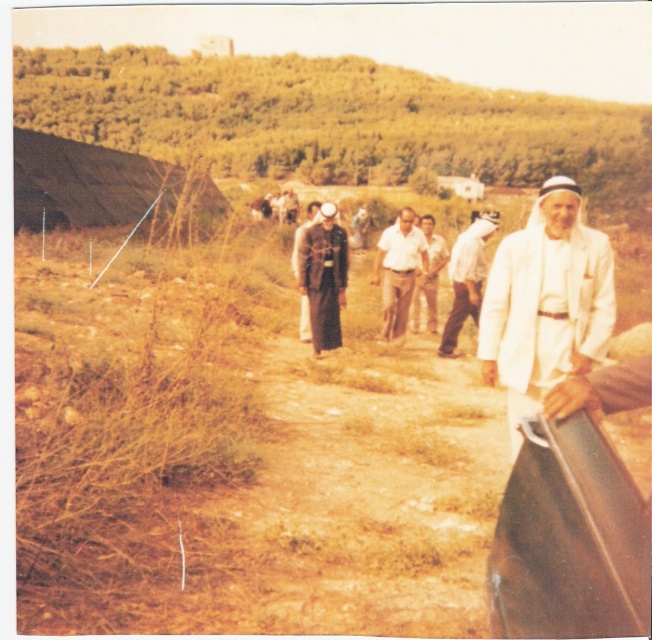
Question: Does brown leather car at center have a smaller size compared to dark gray uniform at center?

Choices:
 (A) yes
 (B) no

Answer: (A)

Question: Estimate the real-world distances between objects in this image. Which object is farther from the light brown cotton shirt at center?

Choices:
 (A) dark gray uniform at center
 (B) light brown leather jacket at center
 (C) brown leather car at center
 (D) white matte jacket at right

Answer: (C)

Question: Does dark gray uniform at center have a lesser width compared to light brown leather jacket at center?

Choices:
 (A) no
 (B) yes

Answer: (A)

Question: Considering the relative positions of brown leather car at center and light brown cotton shirt at center in the image provided, where is brown leather car at center located with respect to light brown cotton shirt at center?

Choices:
 (A) right
 (B) left

Answer: (B)

Question: Which object is positioned closest to the dark gray uniform at center?

Choices:
 (A) brown leather car at center
 (B) light brown leather jacket at center
 (C) white matte jacket at right
 (D) white matte jacket at lower right

Answer: (C)

Question: Which object appears closest to the camera in this image?

Choices:
 (A) light brown cotton shirt at center
 (B) white matte jacket at right
 (C) brown leather car at center
 (D) dark gray uniform at center

Answer: (C)